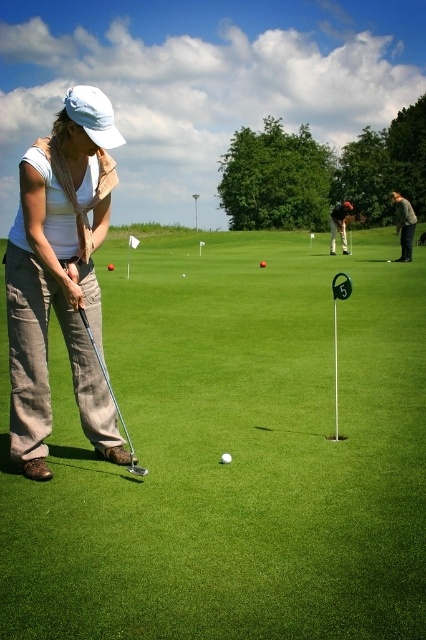
Question: Which of the following is the farthest from the observer?

Choices:
 (A) (345, 236)
 (B) (397, 248)
 (C) (230, 458)

Answer: (B)

Question: Can you confirm if metallic silver putter at left is wider than green matte golf ball at center?

Choices:
 (A) no
 (B) yes

Answer: (B)

Question: Estimate the real-world distances between objects in this image. Which object is farther from the green matte golf ball at center?

Choices:
 (A) shiny black putter at center
 (B) green grass at center

Answer: (A)

Question: Can you confirm if dark gray jacket at center is positioned below green matte golf ball at center?

Choices:
 (A) yes
 (B) no

Answer: (B)

Question: Which of the following is the farthest from the observer?

Choices:
 (A) dark gray jacket at center
 (B) green grass at center
 (C) shiny black putter at center
 (D) metallic silver putter at left

Answer: (C)

Question: Can you confirm if green grass at center is wider than metallic silver putter at left?

Choices:
 (A) yes
 (B) no

Answer: (A)